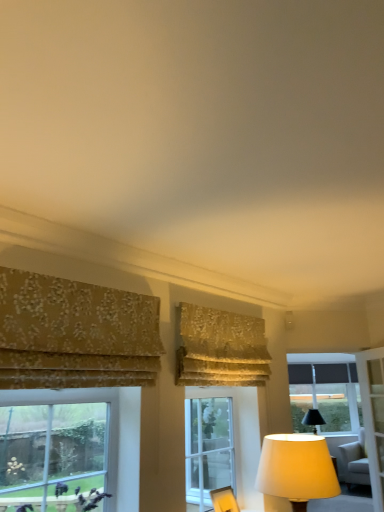
Question: Does clear glass window at lower left, acting as the third window starting from the bottom, have a larger size compared to clear glass window at upper right?

Choices:
 (A) no
 (B) yes

Answer: (A)

Question: Can you confirm if clear glass window at lower left, which is the 1th window in top-to-bottom order, is smaller than clear glass window at upper right?

Choices:
 (A) yes
 (B) no

Answer: (A)

Question: Is clear glass window at lower left, acting as the third window starting from the bottom, turned away from clear glass window at upper right?

Choices:
 (A) yes
 (B) no

Answer: (B)

Question: Would you consider clear glass window at lower left, placed as the first window when sorted from front to back, to be distant from clear glass window at upper right?

Choices:
 (A) no
 (B) yes

Answer: (B)

Question: Is clear glass window at lower left, the third window when ordered from back to front, to the left of clear glass window at upper right from the viewer's perspective?

Choices:
 (A) yes
 (B) no

Answer: (A)

Question: Is black fabric window at right, which ranks as the third window in front-to-back order, wider or thinner than gold floral fabric curtain at left, the second curtain in the right-to-left sequence?

Choices:
 (A) wide
 (B) thin

Answer: (B)

Question: Is black fabric window at right, acting as the 1th window starting from the bottom, inside or outside of gold floral fabric curtain at left, acting as the 1th curtain starting from the front?

Choices:
 (A) outside
 (B) inside

Answer: (A)

Question: From a real-world perspective, relative to gold floral fabric curtain at left, the second curtain in the right-to-left sequence, is black fabric window at right, the first window positioned from the right, vertically above or below?

Choices:
 (A) above
 (B) below

Answer: (B)

Question: Would you say black fabric window at right, which ranks as the third window in front-to-back order, is to the left or to the right of gold floral fabric curtain at left, acting as the 1th curtain starting from the front, in the picture?

Choices:
 (A) left
 (B) right

Answer: (B)

Question: Is black fabric window at right, the first window positioned from the right, taller or shorter than light gray fabric swivel chair at lower right?

Choices:
 (A) tall
 (B) short

Answer: (A)

Question: From a real-world perspective, relative to light gray fabric swivel chair at lower right, is black fabric window at right, the first window positioned from the right, vertically above or below?

Choices:
 (A) above
 (B) below

Answer: (A)

Question: Considering the positions of black fabric window at right, acting as the 1th window starting from the bottom, and light gray fabric swivel chair at lower right in the image, is black fabric window at right, acting as the 1th window starting from the bottom, wider or thinner than light gray fabric swivel chair at lower right?

Choices:
 (A) wide
 (B) thin

Answer: (B)

Question: Considering their positions, is black fabric window at right, acting as the 1th window starting from the bottom, located in front of or behind light gray fabric swivel chair at lower right?

Choices:
 (A) behind
 (B) front

Answer: (A)

Question: In the image, is gold floral fabric curtain at left, positioned as the first curtain in left-to-right order, positioned in front of or behind clear glass window at center, which appears as the second window when viewed from the front?

Choices:
 (A) front
 (B) behind

Answer: (A)

Question: Is gold floral fabric curtain at left, placed as the second curtain when sorted from back to front, wider or thinner than clear glass window at center, which is the 2th window in top-to-bottom order?

Choices:
 (A) wide
 (B) thin

Answer: (A)